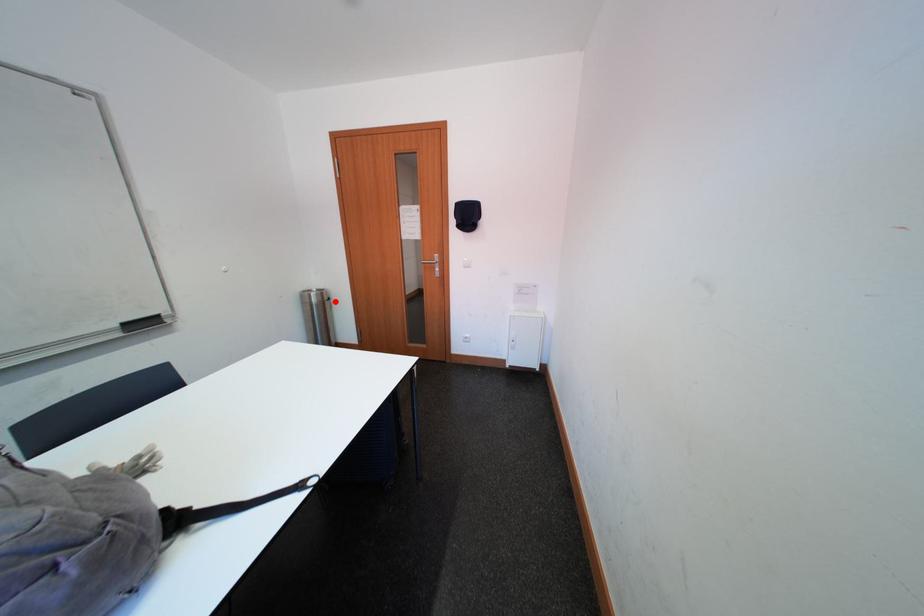
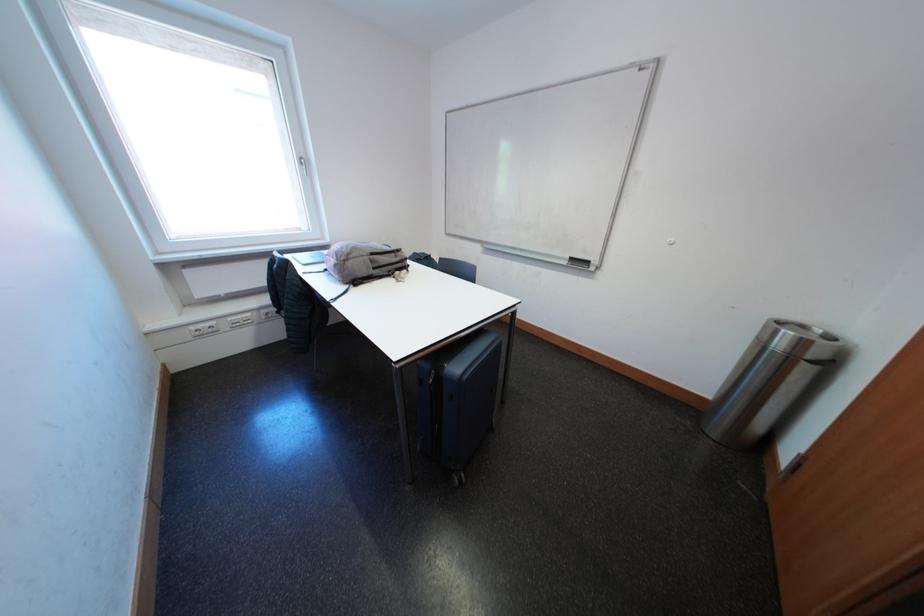
Where in the second image is the point corresponding to the highlighted location from the first image?

(821, 360)